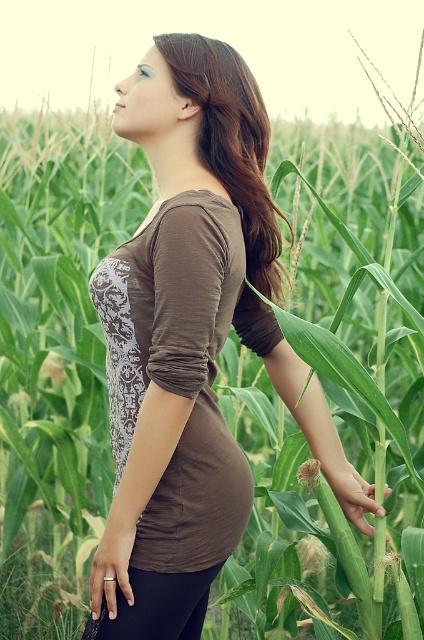
Question: Which point is farther to the camera?

Choices:
 (A) (261, 250)
 (B) (276, 225)

Answer: (A)

Question: Which point is farther from the camera taking this photo?

Choices:
 (A) (250, 134)
 (B) (206, 468)

Answer: (A)

Question: Can you confirm if brown matte shirt at center is positioned below brown matte hair at center?

Choices:
 (A) no
 (B) yes

Answer: (B)

Question: Does brown matte shirt at center appear under brown matte hair at center?

Choices:
 (A) no
 (B) yes

Answer: (B)

Question: Which point is closer to the camera?

Choices:
 (A) brown matte hair at center
 (B) brown matte shirt at center

Answer: (B)

Question: Does brown matte shirt at center have a smaller size compared to brown matte hair at center?

Choices:
 (A) no
 (B) yes

Answer: (A)